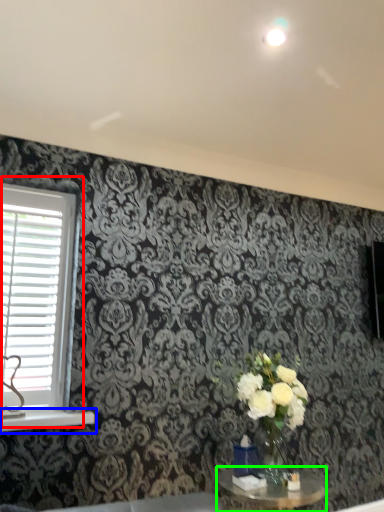
Question: Considering the real-world distances, which object is farthest from window (highlighted by a red box)? window sill (highlighted by a blue box) or table (highlighted by a green box)?

Choices:
 (A) window sill
 (B) table

Answer: (B)